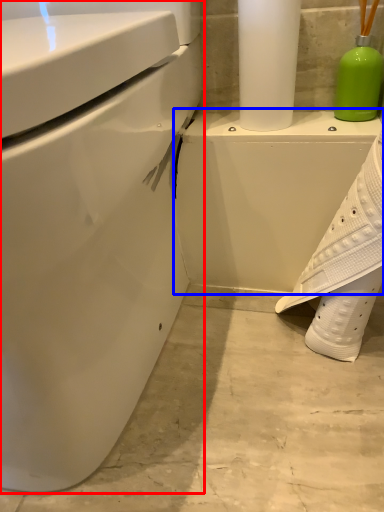
Question: Which of the following is the closest to the observer, toilet (highlighted by a red box) or porcelain (highlighted by a blue box)?

Choices:
 (A) toilet
 (B) porcelain

Answer: (A)